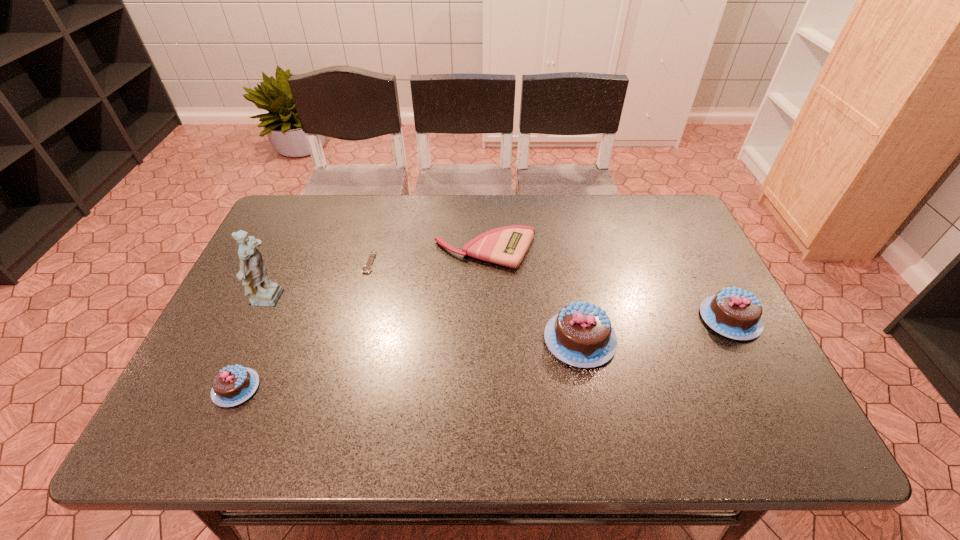
This screenshot has height=540, width=960. I want to click on vacant space at the far edge of the desktop, so click(x=444, y=220).

The height and width of the screenshot is (540, 960). I want to click on vacant area at the near edge, so click(545, 392).

Where is `free space at the right edge of the desktop`? free space at the right edge of the desktop is located at coordinates (708, 280).

In the image, there is a desktop. Find the location of `free space at the far left corner`. free space at the far left corner is located at coordinates (298, 202).

In order to click on free space at the far right corner of the desktop in this screenshot , I will do `click(663, 226)`.

Identify the location of vacant region between the figurine and the shortest chocolate cake. The image size is (960, 540). (253, 345).

The image size is (960, 540). Find the location of `empty space between the second chocolate cake from right to left and the fourth tallest object`. empty space between the second chocolate cake from right to left and the fourth tallest object is located at coordinates (408, 363).

Where is `vacant space that's between the figurine and the second chocolate cake from right to left`? The height and width of the screenshot is (540, 960). vacant space that's between the figurine and the second chocolate cake from right to left is located at coordinates (425, 320).

The width and height of the screenshot is (960, 540). In order to click on vacant area between the tallest object and the fourth tallest object in this screenshot , I will do `click(253, 345)`.

At what (x,y) coordinates should I click in order to perform the action: click on empty space that is in between the watch and the tallest object. Please return your answer as a coordinate pair (x, y). The height and width of the screenshot is (540, 960). Looking at the image, I should click on 320,282.